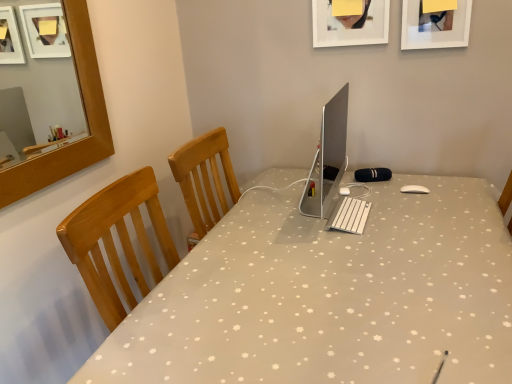
This screenshot has width=512, height=384. Describe the element at coordinates (350, 24) in the screenshot. I see `matte white picture frame at upper center, which is the first picture frame in left-to-right order` at that location.

How much space does matte white picture frame at upper center, the 2th picture frame from the right, occupy horizontally?

matte white picture frame at upper center, the 2th picture frame from the right, is 4.86 centimeters in width.

In order to face white fabric desk at center, should I rotate leftwards or rightwards?

You should rotate right by 11.922 degrees.

In order to click on white matte picture frame at upper right, the 2th picture frame positioned from the left in this screenshot , I will do `click(435, 26)`.

Identify the location of white plastic keyboard at center. Image resolution: width=512 pixels, height=384 pixels. (349, 215).

Where is `matte white picture frame at upper center, the 2th picture frame from the right`? The height and width of the screenshot is (384, 512). matte white picture frame at upper center, the 2th picture frame from the right is located at coordinates (350, 24).

Visually, is silver metallic computer monitor at center positioned to the left or to the right of white matte picture frame at upper right, the 2th picture frame positioned from the left?

From the image, it's evident that silver metallic computer monitor at center is to the left of white matte picture frame at upper right, the 2th picture frame positioned from the left.

Which point is more forward, (x=343, y=152) or (x=466, y=19)?

The point (x=343, y=152) is in front.

Could white matte picture frame at upper right, the 2th picture frame positioned from the left, be considered to be inside silver metallic computer monitor at center?

No, white matte picture frame at upper right, the 2th picture frame positioned from the left, is not a part of silver metallic computer monitor at center.

Is silver metallic computer monitor at center taller than matte white picture frame at upper center, the 2th picture frame from the right?

Correct, silver metallic computer monitor at center is much taller as matte white picture frame at upper center, the 2th picture frame from the right.

From the image's perspective, which one is positioned lower, silver metallic computer monitor at center or matte white picture frame at upper center, which is the first picture frame in left-to-right order?

silver metallic computer monitor at center appears lower in the image.

Measure the distance from silver metallic computer monitor at center to matte white picture frame at upper center, which is the first picture frame in left-to-right order.

20.85 inches.

Which picture frame is the 2nd one when counting from the back of the silver metallic computer monitor at center? Please provide its 2D coordinates.

[(350, 24)]

Which object is thinner, silver metallic computer monitor at center or white fabric desk at center?

silver metallic computer monitor at center is thinner.

From the image's perspective, is silver metallic computer monitor at center below white fabric desk at center?

No, from the image's perspective, silver metallic computer monitor at center is not below white fabric desk at center.

Is silver metallic computer monitor at center facing towards white fabric desk at center?

No, silver metallic computer monitor at center does not turn towards white fabric desk at center.

Choose the correct answer: Is silver metallic computer monitor at center inside white fabric desk at center or outside it?

silver metallic computer monitor at center is located beyond the bounds of white fabric desk at center.

In the image, is matte white picture frame at upper center, which is the first picture frame in left-to-right order, positioned in front of or behind white plastic keyboard at center?

Clearly, matte white picture frame at upper center, which is the first picture frame in left-to-right order, is behind white plastic keyboard at center.

Measure the distance from matte white picture frame at upper center, the 2th picture frame from the right, to white plastic keyboard at center.

79.64 centimeters.

Is matte white picture frame at upper center, which is the first picture frame in left-to-right order, placed right next to white plastic keyboard at center?

matte white picture frame at upper center, which is the first picture frame in left-to-right order, and white plastic keyboard at center are clearly separated.

Does matte white picture frame at upper center, which is the first picture frame in left-to-right order, have a lesser height compared to white plastic keyboard at center?

No.

Can you confirm if white fabric desk at center is shorter than white matte picture frame at upper right, the 2th picture frame positioned from the left?

In fact, white fabric desk at center may be taller than white matte picture frame at upper right, the 2th picture frame positioned from the left.

Relative to white matte picture frame at upper right, the first picture frame in the right-to-left sequence, is white fabric desk at center in front or behind?

white fabric desk at center is in front of white matte picture frame at upper right, the first picture frame in the right-to-left sequence.

Which is closer, (511, 340) or (442, 47)?

The point (511, 340) is in front.

Based on the photo, would you say white fabric desk at center is to the left or to the right of white matte picture frame at upper right, the first picture frame in the right-to-left sequence, in the picture?

Based on their positions, white fabric desk at center is located to the left of white matte picture frame at upper right, the first picture frame in the right-to-left sequence.

Could matte white picture frame at upper center, which is the first picture frame in left-to-right order, be considered to be inside white plastic keyboard at center?

No, white plastic keyboard at center does not contain matte white picture frame at upper center, which is the first picture frame in left-to-right order.

Can you confirm if white plastic keyboard at center is taller than matte white picture frame at upper center, which is the first picture frame in left-to-right order?

Incorrect, the height of white plastic keyboard at center is not larger of that of matte white picture frame at upper center, which is the first picture frame in left-to-right order.

Can you confirm if white plastic keyboard at center is positioned to the left of matte white picture frame at upper center, the 2th picture frame from the right?

Indeed, white plastic keyboard at center is positioned on the left side of matte white picture frame at upper center, the 2th picture frame from the right.

From a real-world perspective, is white plastic keyboard at center positioned above or below matte white picture frame at upper center, the 2th picture frame from the right?

white plastic keyboard at center is situated lower than matte white picture frame at upper center, the 2th picture frame from the right, in the real world.

From the image's perspective, is matte white picture frame at upper center, which is the first picture frame in left-to-right order, on white fabric desk at center?

Yes, from the image's perspective, matte white picture frame at upper center, which is the first picture frame in left-to-right order, is above white fabric desk at center.

Is matte white picture frame at upper center, the 2th picture frame from the right, to the right of white fabric desk at center from the viewer's perspective?

Indeed, matte white picture frame at upper center, the 2th picture frame from the right, is positioned on the right side of white fabric desk at center.

Does point (343, 20) come closer to viewer compared to point (319, 322)?

No.

Considering the positions of objects matte white picture frame at upper center, the 2th picture frame from the right, and white fabric desk at center in the image provided, who is behind, matte white picture frame at upper center, the 2th picture frame from the right, or white fabric desk at center?

matte white picture frame at upper center, the 2th picture frame from the right, is further from the camera.

At what (x,y) coordinates should I click in order to perform the action: click on the 1st picture frame behind the silver metallic computer monitor at center, starting your count from the anchor. Please return your answer as a coordinate pair (x, y). Looking at the image, I should click on (435, 26).

Locate an element on the screen. computer monitor located below the matte white picture frame at upper center, the 2th picture frame from the right (from the image's perspective) is located at coordinates (327, 158).

When comparing their distances from matte white picture frame at upper center, which is the first picture frame in left-to-right order, does white matte picture frame at upper right, the 2th picture frame positioned from the left, or white fabric desk at center seem closer?

white matte picture frame at upper right, the 2th picture frame positioned from the left.

When comparing their distances from matte white picture frame at upper center, the 2th picture frame from the right, does white matte picture frame at upper right, the 2th picture frame positioned from the left, or silver metallic computer monitor at center seem closer?

white matte picture frame at upper right, the 2th picture frame positioned from the left, lies closer to matte white picture frame at upper center, the 2th picture frame from the right, than the other object.

When comparing their distances from white fabric desk at center, does silver metallic computer monitor at center or white plastic keyboard at center seem further?

silver metallic computer monitor at center lies further to white fabric desk at center than the other object.

In the scene shown: Estimate the real-world distances between objects in this image. Which object is closer to white matte picture frame at upper right, the 2th picture frame positioned from the left, matte white picture frame at upper center, the 2th picture frame from the right, or white fabric desk at center?

matte white picture frame at upper center, the 2th picture frame from the right, is closer to white matte picture frame at upper right, the 2th picture frame positioned from the left.

Consider the image. Considering their positions, is white plastic keyboard at center positioned further to white fabric desk at center than white matte picture frame at upper right, the 2th picture frame positioned from the left?

white matte picture frame at upper right, the 2th picture frame positioned from the left, is positioned further to the anchor white fabric desk at center.

Looking at the image, which one is located closer to matte white picture frame at upper center, which is the first picture frame in left-to-right order, silver metallic computer monitor at center or white plastic keyboard at center?

Among the two, silver metallic computer monitor at center is located nearer to matte white picture frame at upper center, which is the first picture frame in left-to-right order.

Which object lies nearer to the anchor point white fabric desk at center, silver metallic computer monitor at center or white matte picture frame at upper right, the first picture frame in the right-to-left sequence?

silver metallic computer monitor at center is closer to white fabric desk at center.

From the image, which object appears to be farther from matte white picture frame at upper center, which is the first picture frame in left-to-right order, silver metallic computer monitor at center or white fabric desk at center?

white fabric desk at center lies further to matte white picture frame at upper center, which is the first picture frame in left-to-right order, than the other object.

Where is `computer monitor between white fabric desk at center and white plastic keyboard at center along the z-axis`? The height and width of the screenshot is (384, 512). computer monitor between white fabric desk at center and white plastic keyboard at center along the z-axis is located at coordinates (327, 158).

Where is `laptop keyboard between matte white picture frame at upper center, the 2th picture frame from the right, and white fabric desk at center vertically`? laptop keyboard between matte white picture frame at upper center, the 2th picture frame from the right, and white fabric desk at center vertically is located at coordinates (349, 215).

Image resolution: width=512 pixels, height=384 pixels. What are the coordinates of `computer monitor between matte white picture frame at upper center, which is the first picture frame in left-to-right order, and white fabric desk at center vertically` in the screenshot? It's located at (327, 158).

I want to click on laptop keyboard that lies between white matte picture frame at upper right, the first picture frame in the right-to-left sequence, and white fabric desk at center from top to bottom, so click(349, 215).